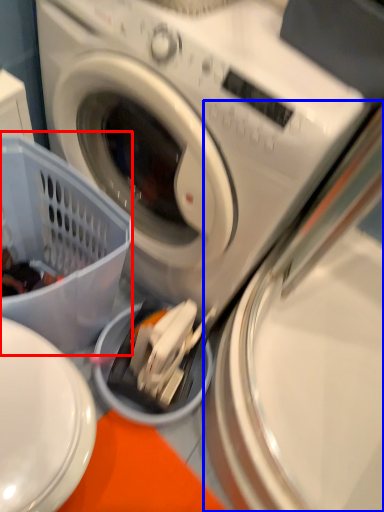
Question: Among these objects, which one is nearest to the camera, basket (highlighted by a red box) or washing machine (highlighted by a blue box)?

Choices:
 (A) basket
 (B) washing machine

Answer: (A)